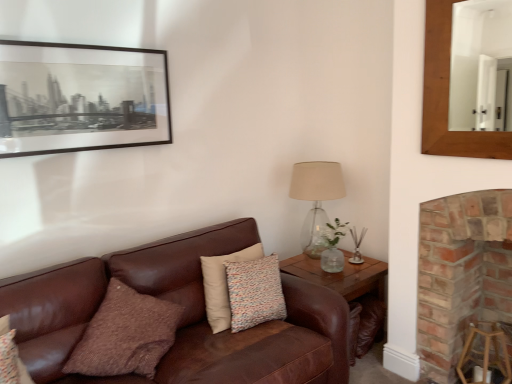
Where is `wooden mirror at upper right`? This screenshot has height=384, width=512. wooden mirror at upper right is located at coordinates (481, 66).

This screenshot has width=512, height=384. Describe the element at coordinates (182, 316) in the screenshot. I see `brown leather couch at center` at that location.

Image resolution: width=512 pixels, height=384 pixels. What do you see at coordinates (81, 98) in the screenshot?
I see `black matte picture frame at upper left` at bounding box center [81, 98].

Where is `wooden mirror at upper right`? The width and height of the screenshot is (512, 384). wooden mirror at upper right is located at coordinates (481, 66).

In the scene shown: How different are the orientations of brown leather couch at center and translucent glass table lamp at right in degrees?

The facing directions of brown leather couch at center and translucent glass table lamp at right are 2.62 degrees apart.

Could you tell me if brown leather couch at center is turned towards translucent glass table lamp at right?

No, brown leather couch at center is not oriented towards translucent glass table lamp at right.

Between brown leather couch at center and translucent glass table lamp at right, which one appears on the right side from the viewer's perspective?

translucent glass table lamp at right is more to the right.

Is brown textured pillow at center positioned far away from brown leather couch at center?

No, brown textured pillow at center is not far from brown leather couch at center.

In terms of size, does brown textured pillow at center appear bigger or smaller than brown leather couch at center?

In the image, brown textured pillow at center appears to be smaller than brown leather couch at center.

Consider the image. From the image's perspective, between brown textured pillow at center and brown leather couch at center, which one is located above?

brown textured pillow at center.

Is brown textured pillow at center oriented away from brown leather couch at center?

Yes, brown leather couch at center is at the back of brown textured pillow at center.

Is wooden side table at lower right spatially inside brick fireplace at right, or outside of it?

wooden side table at lower right is spatially situated outside brick fireplace at right.

In the scene shown: Between wooden side table at lower right and brick fireplace at right, which one has larger size?

brick fireplace at right.

In the image, is wooden side table at lower right positioned in front of or behind brick fireplace at right?

Visually, wooden side table at lower right is located behind brick fireplace at right.

Considering the sizes of objects brick fireplace at right and black matte picture frame at upper left in the image provided, who is shorter, brick fireplace at right or black matte picture frame at upper left?

black matte picture frame at upper left.

Is brick fireplace at right thinner than black matte picture frame at upper left?

No, brick fireplace at right is not thinner than black matte picture frame at upper left.

Is point (492, 225) positioned in front of point (42, 114)?

Yes, point (492, 225) is closer to viewer.

How different are the orientations of brown leather couch at center and black matte picture frame at upper left in degrees?

The angle between the facing direction of brown leather couch at center and the facing direction of black matte picture frame at upper left is 0.407 degrees.

Between brown leather couch at center and black matte picture frame at upper left, which one appears on the right side from the viewer's perspective?

brown leather couch at center is more to the right.

Does brown leather couch at center lie behind black matte picture frame at upper left?

No, brown leather couch at center is closer to the camera.

How distant is brown leather couch at center from black matte picture frame at upper left?

37.73 inches.

Which is nearer, (455, 61) or (336, 184)?

Point (455, 61) is positioned farther from the camera compared to point (336, 184).

Is wooden mirror at upper right positioned behind translucent glass table lamp at right?

No, wooden mirror at upper right is in front of translucent glass table lamp at right.

Is wooden mirror at upper right turned away from translucent glass table lamp at right?

No.

Considering the relative positions of wooden mirror at upper right and translucent glass table lamp at right in the image provided, is wooden mirror at upper right to the left of translucent glass table lamp at right from the viewer's perspective?

No.

From a real-world perspective, which is physically above, black matte picture frame at upper left or brick fireplace at right?

black matte picture frame at upper left is physically above.

Looking at this image, how many degrees apart are the facing directions of black matte picture frame at upper left and brick fireplace at right?

black matte picture frame at upper left and brick fireplace at right are facing 90.3 degrees away from each other.

Considering the relative sizes of black matte picture frame at upper left and brick fireplace at right in the image provided, is black matte picture frame at upper left shorter than brick fireplace at right?

Indeed, black matte picture frame at upper left has a lesser height compared to brick fireplace at right.

Considering the relative positions of black matte picture frame at upper left and brick fireplace at right in the image provided, is black matte picture frame at upper left to the left of brick fireplace at right from the viewer's perspective?

Correct, you'll find black matte picture frame at upper left to the left of brick fireplace at right.

Identify the location of table lamp behind the brown leather couch at center. (316, 199).

At what (x,y) coordinates should I click in order to perform the action: click on pillow that appears above the brown leather couch at center (from the image's perspective). Please return your answer as a coordinate pair (x, y). This screenshot has height=384, width=512. Looking at the image, I should click on (125, 334).

Considering their positions, is brown leather couch at center positioned closer to wooden side table at lower right than wooden stool at lower right?

brown leather couch at center.

Based on their spatial positions, is brick fireplace at right or brown textured pillow at center further from translucent glass table lamp at right?

The object further to translucent glass table lamp at right is brown textured pillow at center.

Estimate the real-world distances between objects in this image. Which object is further from wooden side table at lower right, wooden mirror at upper right or black matte picture frame at upper left?

wooden mirror at upper right.

From the image, which object appears to be farther from wooden mirror at upper right, brown textured pillow at center or translucent glass table lamp at right?

brown textured pillow at center is positioned further to the anchor wooden mirror at upper right.

Considering their positions, is brown textured pillow at center positioned further to black matte picture frame at upper left than wooden stool at lower right?

Among the two, wooden stool at lower right is located further to black matte picture frame at upper left.

Which object lies further to the anchor point translucent glass table lamp at right, wooden stool at lower right or black matte picture frame at upper left?

black matte picture frame at upper left is positioned further to the anchor translucent glass table lamp at right.

Looking at the image, which one is located closer to wooden mirror at upper right, black matte picture frame at upper left or translucent glass table lamp at right?

The object closer to wooden mirror at upper right is translucent glass table lamp at right.

When comparing their distances from brick fireplace at right, does wooden stool at lower right or translucent glass table lamp at right seem closer?

Among the two, wooden stool at lower right is located nearer to brick fireplace at right.

The height and width of the screenshot is (384, 512). Identify the location of pillow between brown leather couch at center and wooden side table at lower right along the z-axis. (125, 334).

Identify the location of studio couch situated between black matte picture frame at upper left and brick fireplace at right from left to right. Image resolution: width=512 pixels, height=384 pixels. (182, 316).

Locate an element on the screen. Image resolution: width=512 pixels, height=384 pixels. table lamp that lies between wooden mirror at upper right and wooden side table at lower right from top to bottom is located at coordinates (316, 199).

Locate an element on the screen. This screenshot has height=384, width=512. table lamp between black matte picture frame at upper left and wooden mirror at upper right from left to right is located at coordinates (316, 199).